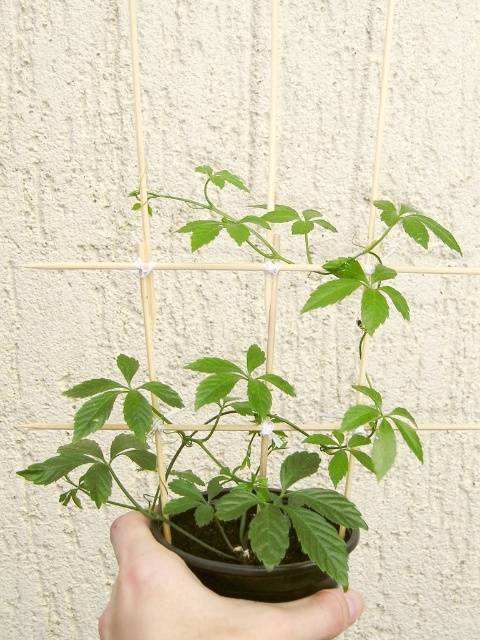
You are holding a black matte hand at center and see a green matte plant at center. Which object is positioned to the right side?

The green matte plant at center is positioned to the right of the black matte hand at center.

What are the coordinates of the green matte plant at center?

The green matte plant at center is located at point (229, 467).